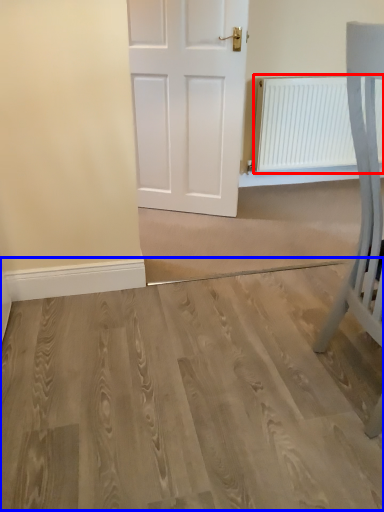
Question: Which object appears closest to the camera in this image, radiator (highlighted by a red box) or plain (highlighted by a blue box)?

Choices:
 (A) radiator
 (B) plain

Answer: (B)